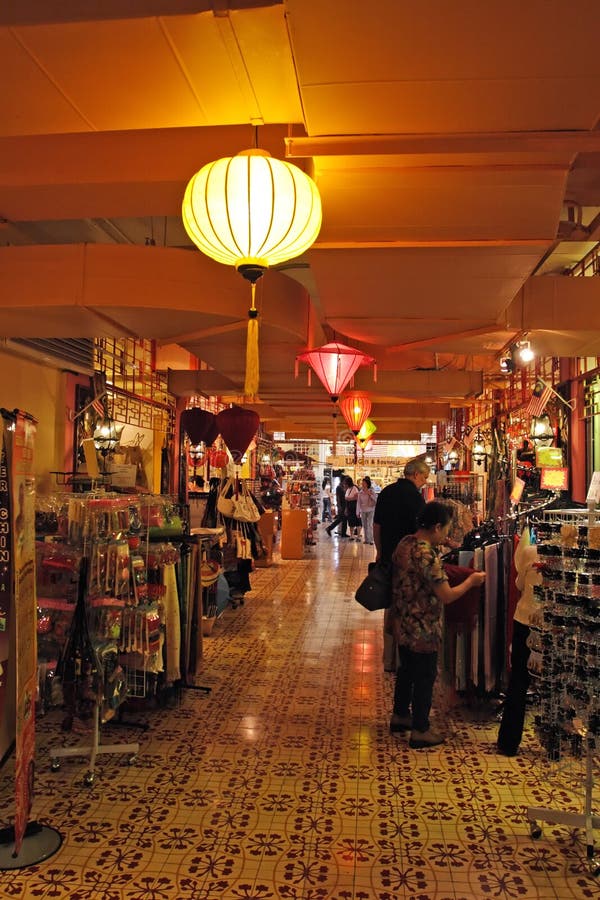
Identify the location of yellow tiled floor. (329, 789).